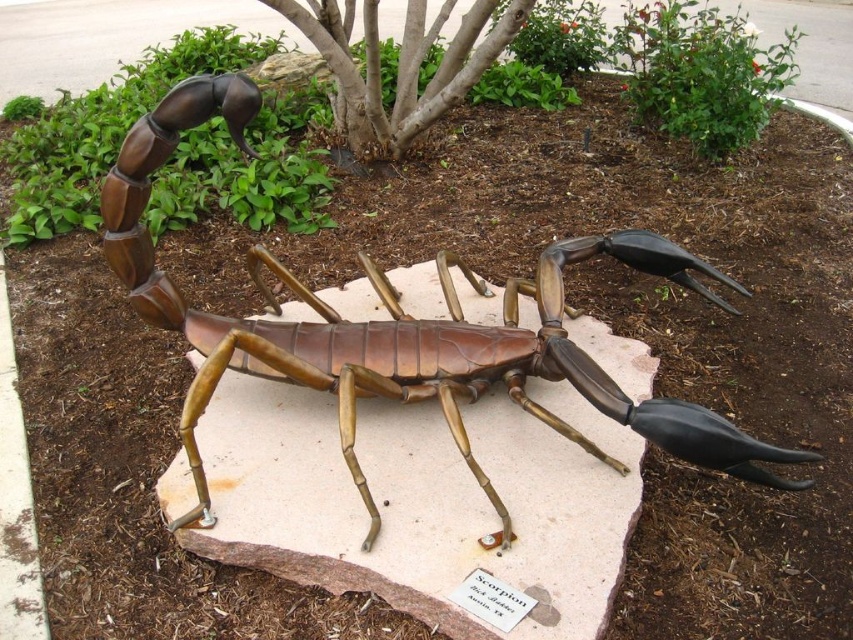
Does bronze metallic scorpion at center appear under brown bark tree at center?

Indeed, bronze metallic scorpion at center is positioned under brown bark tree at center.

Measure the distance between point [178,435] and camera.

They are 2.29 meters apart.

Identify the location of bronze metallic scorpion at center. (405, 328).